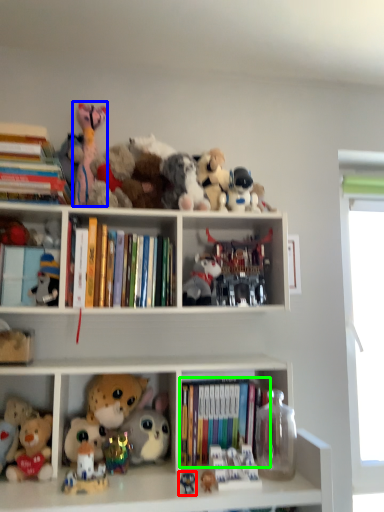
Question: Which object is positioned closest to toy (highlighted by a red box)? Select from toy (highlighted by a blue box) and book (highlighted by a green box).

Choices:
 (A) toy
 (B) book

Answer: (B)